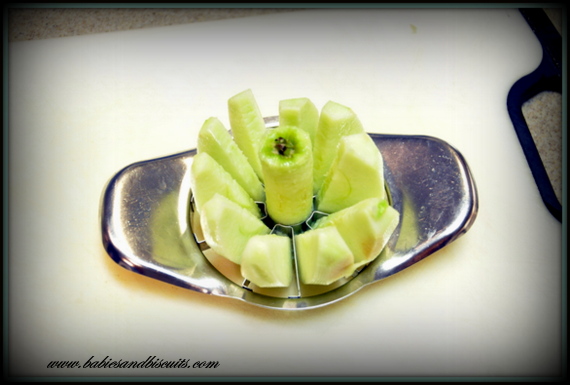
You are a GUI agent. You are given a task and a screenshot of the screen. Output one action in this format:
    pyautogui.click(x=<x>, y=<y>)
    Task: Click on the granite countertop
    This screenshot has width=570, height=385.
    Given the screenshot: What is the action you would take?
    pyautogui.click(x=144, y=20)